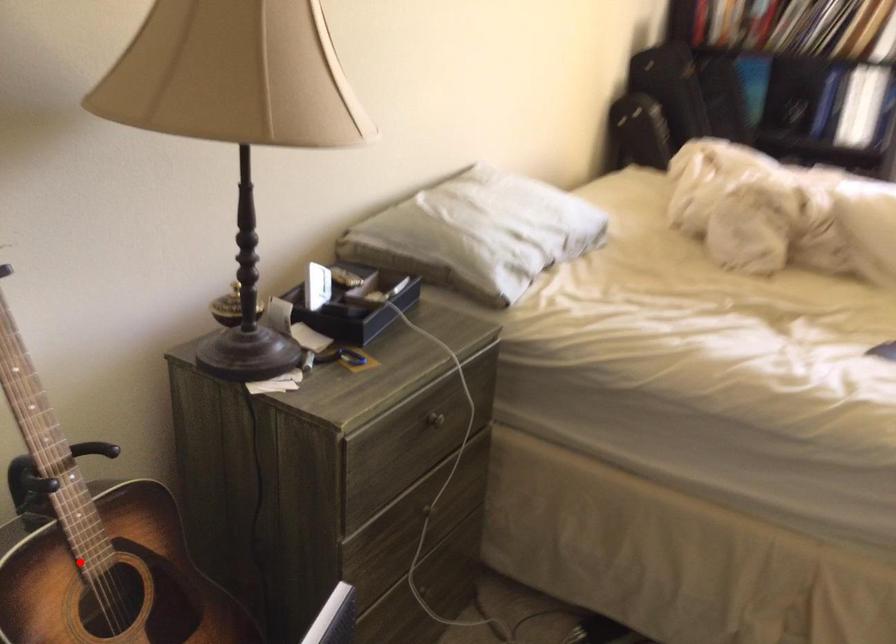
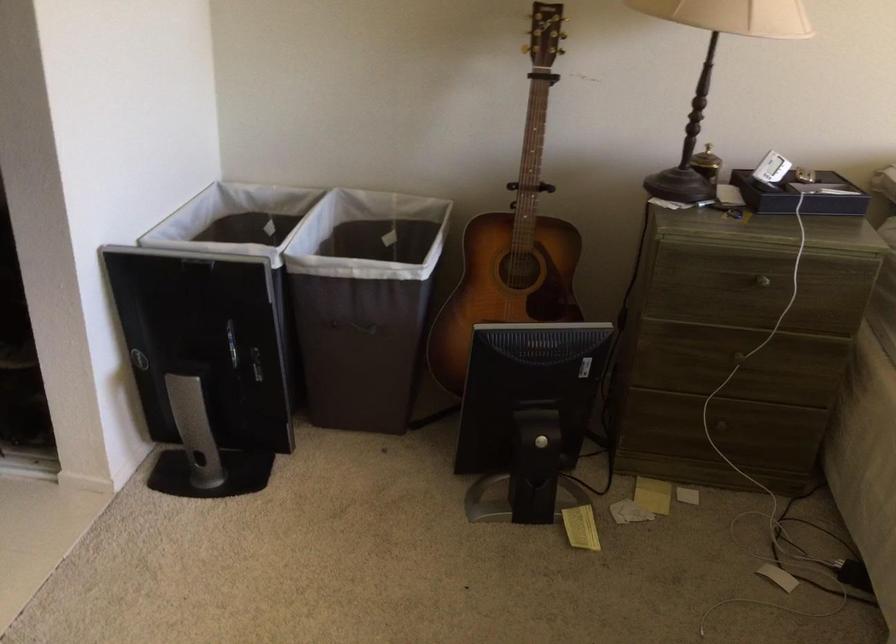
Question: A red point is marked in image1. In image2, is the corresponding 3D point closer to the camera or farther? Reply with the corresponding letter.

Choices:
 (A) The corresponding 3D point is closer.
 (B) The corresponding 3D point is farther.

Answer: (B)